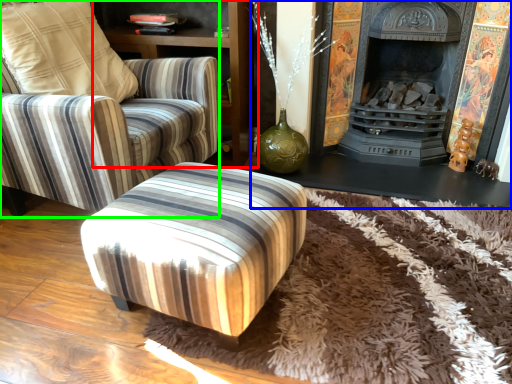
Question: Considering the real-world distances, which object is farthest from dresser (highlighted by a red box)? fireplace (highlighted by a blue box) or chair (highlighted by a green box)?

Choices:
 (A) fireplace
 (B) chair

Answer: (A)